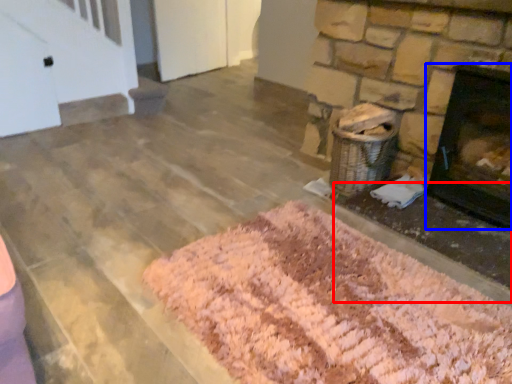
Question: Among these objects, which one is farthest to the camera, foundation (highlighted by a red box) or fireplace (highlighted by a blue box)?

Choices:
 (A) foundation
 (B) fireplace

Answer: (B)